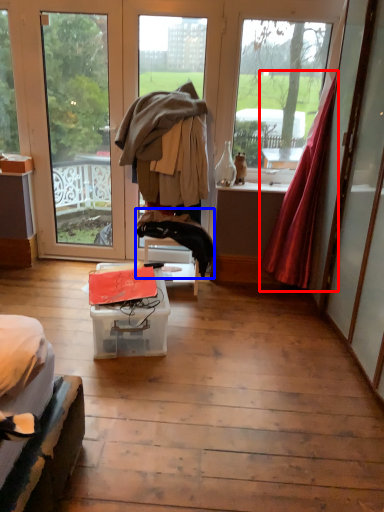
Question: Which object is closer to the camera taking this photo, curtain (highlighted by a red box) or clothing (highlighted by a blue box)?

Choices:
 (A) curtain
 (B) clothing

Answer: (A)